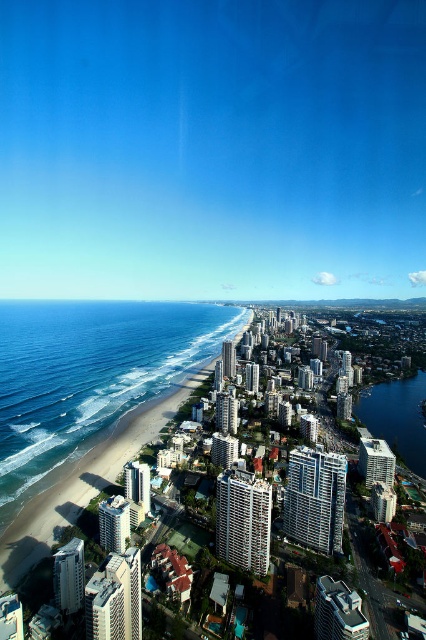
Is blue water at beach left bigger than blue glassy water at right?

Indeed, blue water at beach left has a larger size compared to blue glassy water at right.

Which is more to the right, blue water at beach left or blue glassy water at right?

From the viewer's perspective, blue glassy water at right appears more on the right side.

Between point (109, 376) and point (354, 406), which one is positioned behind?

Point (354, 406)

This screenshot has height=640, width=426. Find the location of `blue water at beach left`. blue water at beach left is located at coordinates (88, 378).